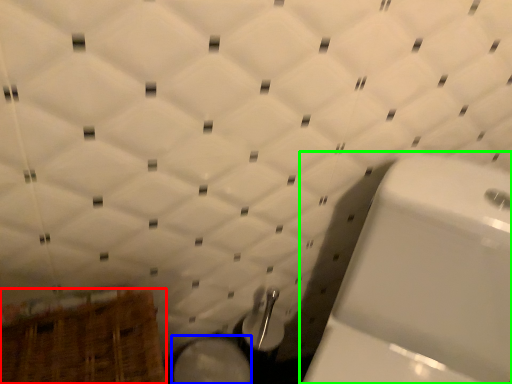
Question: Which is farther away from basket (highlighted by a red box)? bidet (highlighted by a blue box) or toilet (highlighted by a green box)?

Choices:
 (A) bidet
 (B) toilet

Answer: (B)